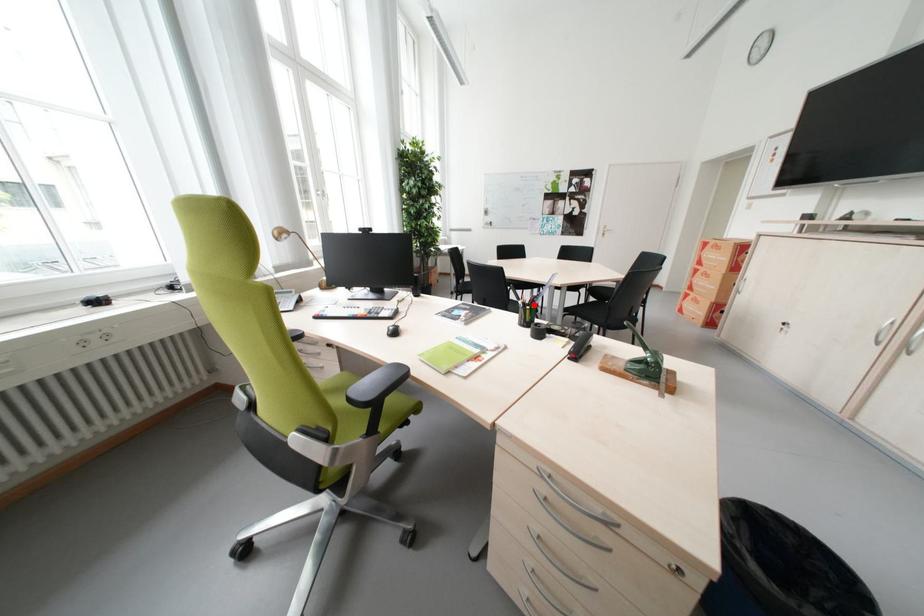
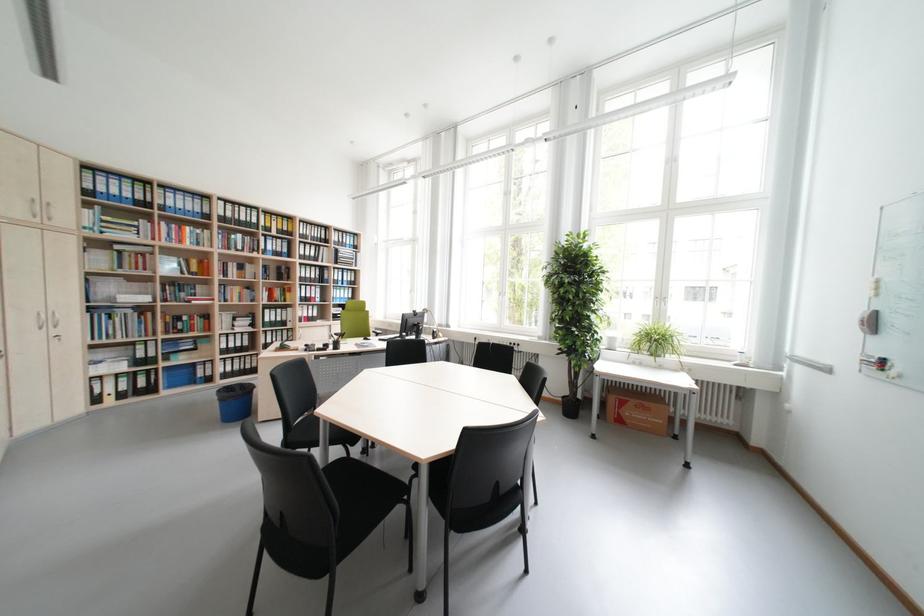
Question: I am providing you with two images of the same scene from different viewpoints. A red point is marked on the first image. Can you still see the location of the red point in image 2?

Choices:
 (A) Yes
 (B) No

Answer: (B)